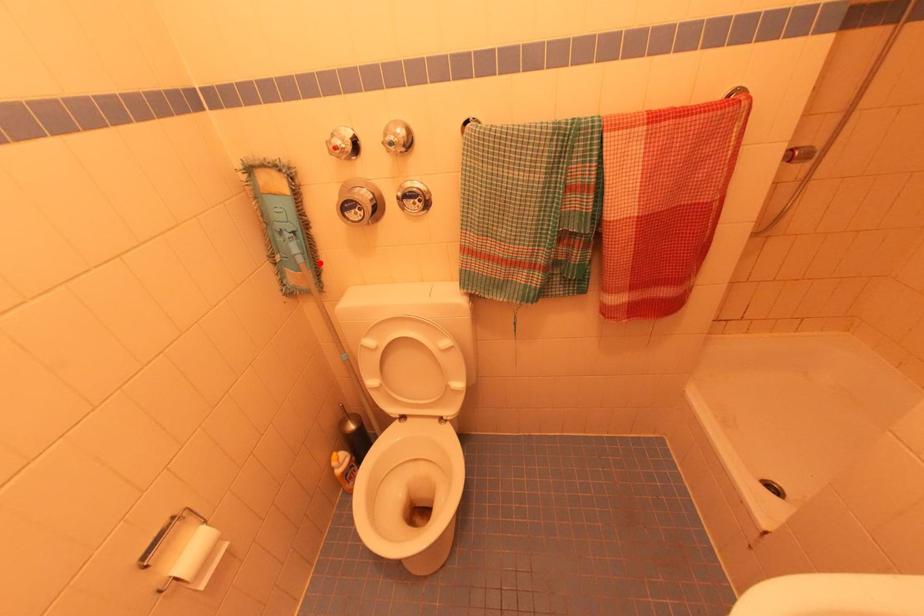
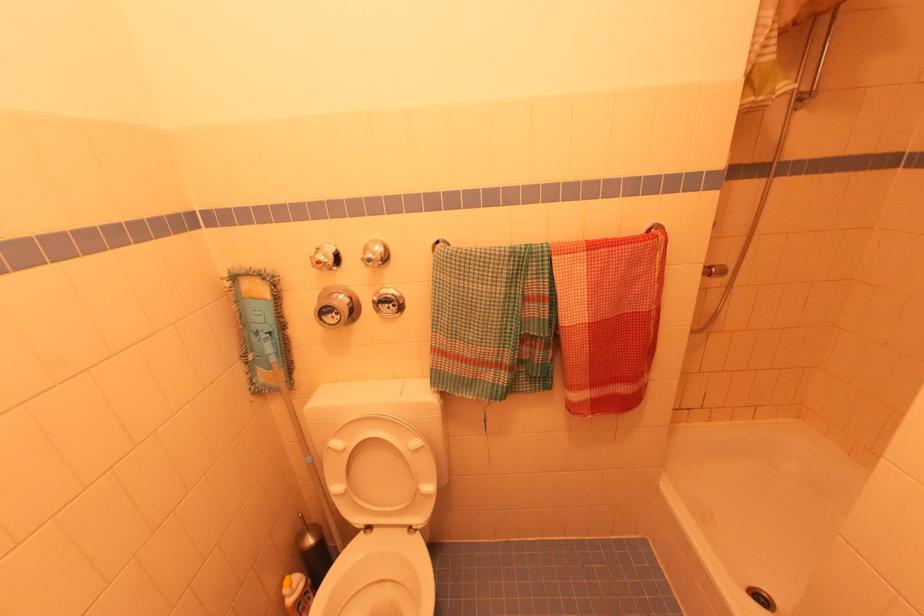
Question: I am providing you with two images of the same scene from different viewpoints. In image1, a red point is highlighted. Considering the same 3D point in image2, which of the following is correct?

Choices:
 (A) It is closer
 (B) It is farther

Answer: (B)